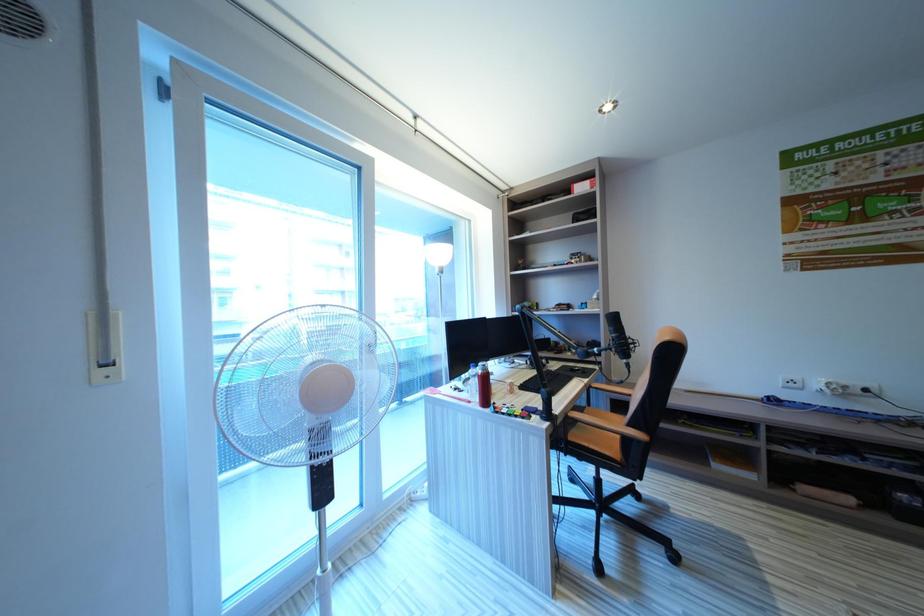
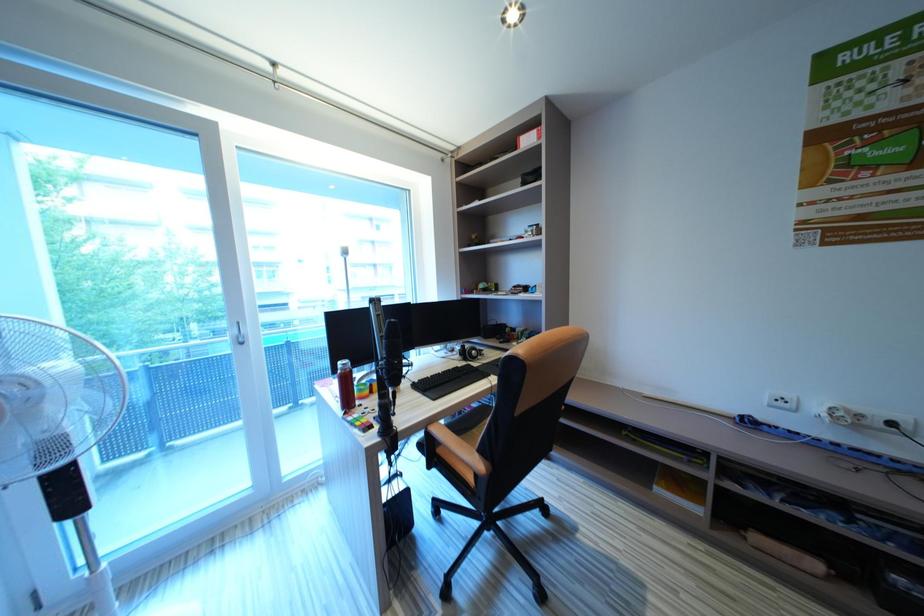
Question: The images are taken continuously from a first-person perspective. In which direction is your viewpoint rotating?

Choices:
 (A) Left
 (B) Right
 (C) Up
 (D) Down

Answer: (A)